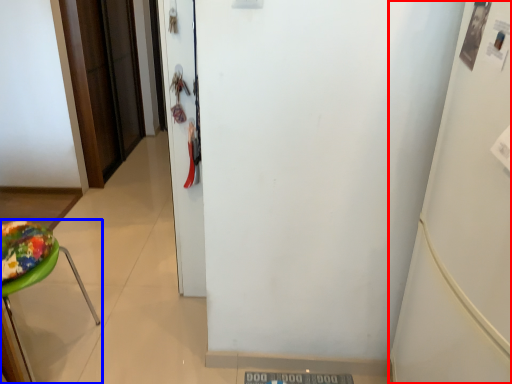
Question: Which of the following is the farthest to the observer, fridge (highlighted by a red box) or furniture (highlighted by a blue box)?

Choices:
 (A) fridge
 (B) furniture

Answer: (B)